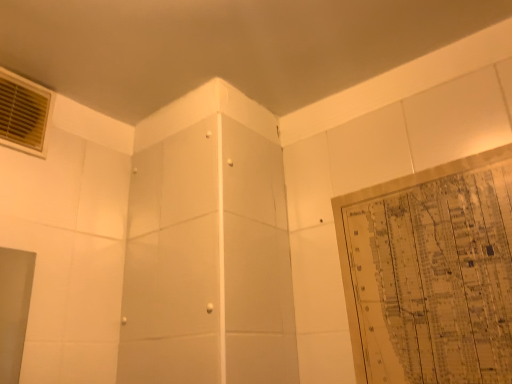
The height and width of the screenshot is (384, 512). What do you see at coordinates (23, 113) in the screenshot?
I see `matte white vent at upper left` at bounding box center [23, 113].

This screenshot has width=512, height=384. In order to click on matte white vent at upper left in this screenshot , I will do `click(23, 113)`.

Locate an element on the screen. matte white vent at upper left is located at coordinates (23, 113).